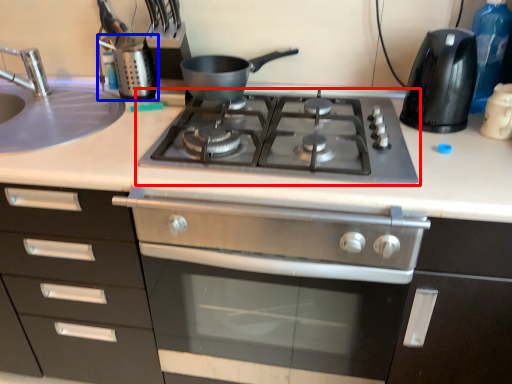
Question: Which of the following is the closest to the observer, gas stove (highlighted by a red box) or appliance (highlighted by a blue box)?

Choices:
 (A) gas stove
 (B) appliance

Answer: (A)